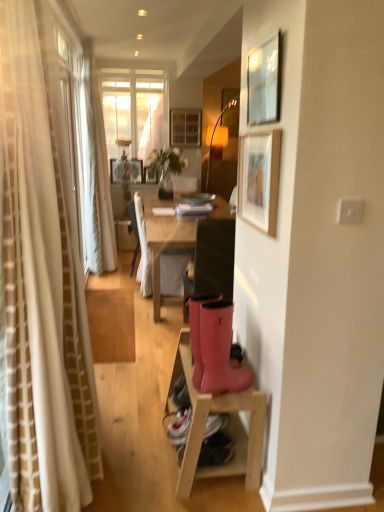
Question: From a real-world perspective, is white fabric chair at center, positioned as the first chair in left-to-right order, physically located above or below wooden picture frame at center, the fourth picture frame positioned from the front?

Choices:
 (A) above
 (B) below

Answer: (B)

Question: In terms of width, does white fabric chair at center, which appears as the second chair when viewed from the front, look wider or thinner when compared to wooden picture frame at center, the 3th picture frame from the bottom?

Choices:
 (A) wide
 (B) thin

Answer: (A)

Question: Considering the real-world distances, which object is closest to the wooden stool at lower right?

Choices:
 (A) white fabric chair at center, which appears as the second chair when viewed from the front
 (B) translucent glass vase at center
 (C) wooden picture frame at upper right, which is the 3th picture frame from back to front
 (D) wooden picture frame at center, the fourth picture frame positioned from the front
 (E) metallic silver picture frame at upper right, the 4th picture frame from the left

Answer: (C)

Question: Which is farther from the wooden stool at lower right?

Choices:
 (A) white fabric chair at center, which appears as the 2th chair when viewed from the right
 (B) matte black chair at center, which is the 1th chair from front to back
 (C) matte wooden cabinet at upper center
 (D) metallic silver picture frame at upper right, placed as the 1th picture frame when sorted from front to back
 (E) rubber boots at lower center

Answer: (C)